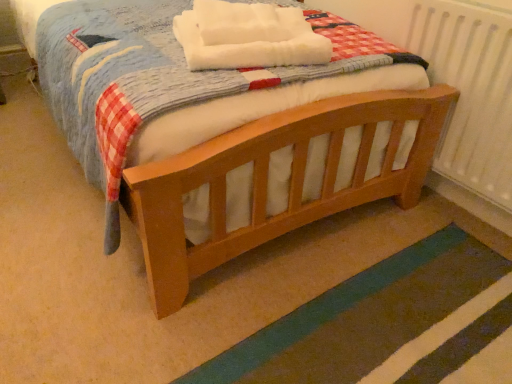
Question: Choose the correct answer: Is white soft blanket at center inside wooden bed at center or outside it?

Choices:
 (A) outside
 (B) inside

Answer: (A)

Question: Is point (264, 62) positioned closer to the camera than point (146, 235)?

Choices:
 (A) farther
 (B) closer

Answer: (A)

Question: Which of these objects is positioned farthest from the wooden bed at center?

Choices:
 (A) white textured radiator at right
 (B) teal rug at lower right
 (C) white soft blanket at center

Answer: (B)

Question: Estimate the real-world distances between objects in this image. Which object is closer to the teal rug at lower right?

Choices:
 (A) wooden bed at center
 (B) white soft blanket at center
 (C) white textured radiator at right

Answer: (A)